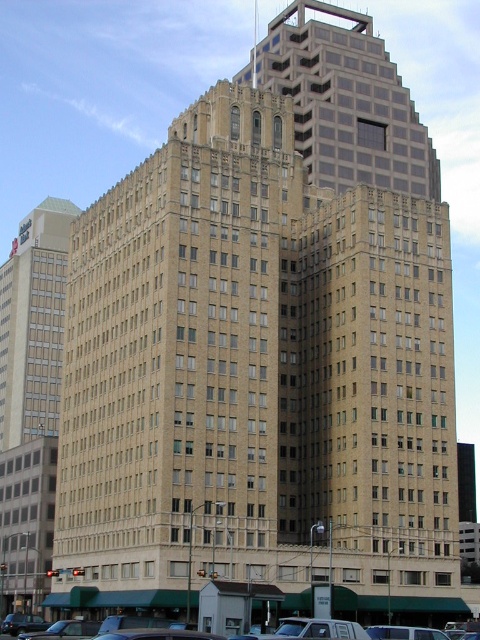
You are standing in front of the building and want to determine which of the two points, point (x=361, y=84) or point (x=1, y=291), is closer to you. Based on the building structure described, which point is nearer?

Point (x=361, y=84) is closer to the viewer than point (x=1, y=291).

You are standing on the sidewalk in front of the brown brick building at upper center and the beige brick building at left. Which building is positioned higher up in the image?

The brown brick building at upper center is located above the beige brick building at left in the image.